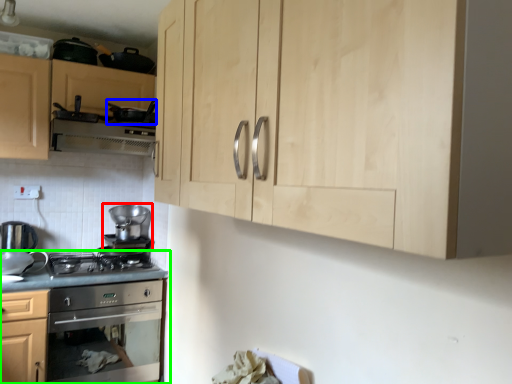
Question: Which is nearer to the appliance (highlighted by a red box)? appliance (highlighted by a blue box) or countertop (highlighted by a green box).

Choices:
 (A) appliance
 (B) countertop

Answer: (B)